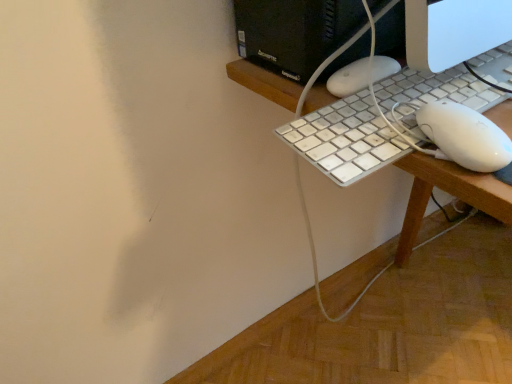
Question: Is white plastic keyboard at center in front of or behind white plastic keyboard at right in the image?

Choices:
 (A) behind
 (B) front

Answer: (B)

Question: From a real-world perspective, is white plastic keyboard at center above or below white plastic keyboard at right?

Choices:
 (A) above
 (B) below

Answer: (B)

Question: Based on their positions, is white plastic keyboard at center located to the left or right of white plastic keyboard at right?

Choices:
 (A) right
 (B) left

Answer: (A)

Question: Looking at the image, does white plastic keyboard at right seem bigger or smaller compared to white plastic keyboard at center?

Choices:
 (A) small
 (B) big

Answer: (A)

Question: Would you say white plastic keyboard at right is to the left or to the right of white plastic keyboard at center in the picture?

Choices:
 (A) left
 (B) right

Answer: (A)

Question: From a real-world perspective, is white plastic keyboard at right physically located above or below white plastic keyboard at center?

Choices:
 (A) below
 (B) above

Answer: (B)

Question: Which is correct: white plastic keyboard at right is inside white plastic keyboard at center, or outside of it?

Choices:
 (A) inside
 (B) outside

Answer: (B)